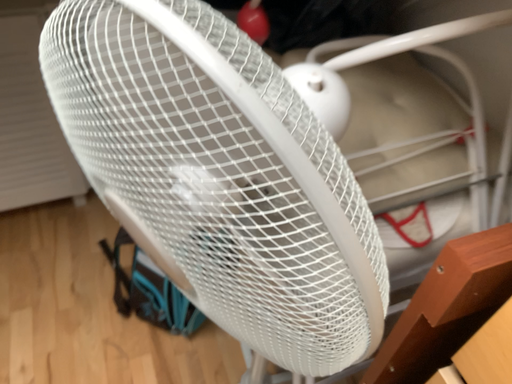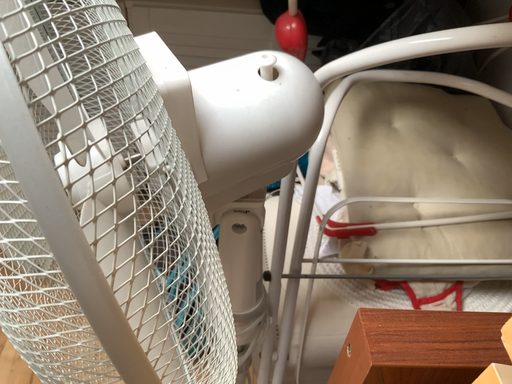
Question: Which way did the camera rotate in the video?

Choices:
 (A) rotated downward
 (B) rotated upward

Answer: (B)